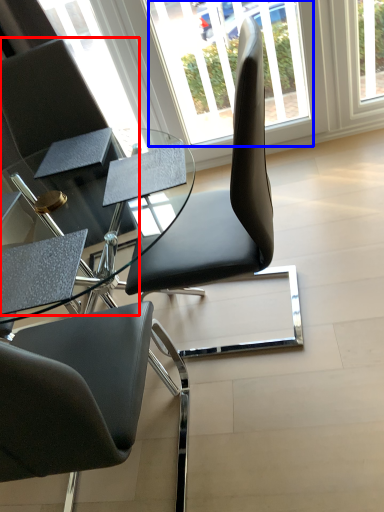
Question: Which object appears closest to the camera in this image, chair (highlighted by a red box) or window (highlighted by a blue box)?

Choices:
 (A) chair
 (B) window

Answer: (A)